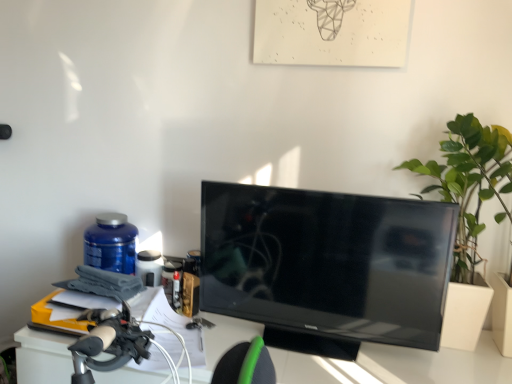
Question: In the image, is blue plastic bottle at left positioned in front of or behind black glossy tv at center?

Choices:
 (A) front
 (B) behind

Answer: (B)

Question: Which is correct: blue plastic bottle at left is inside black glossy tv at center, or outside of it?

Choices:
 (A) inside
 (B) outside

Answer: (B)

Question: Which is nearer to the blue plastic bottle at left?

Choices:
 (A) green leafy plant at right
 (B) black glossy tv at center

Answer: (B)

Question: Estimate the real-world distances between objects in this image. Which object is closer to the black glossy tv at center?

Choices:
 (A) blue plastic bottle at left
 (B) green leafy plant at right

Answer: (B)